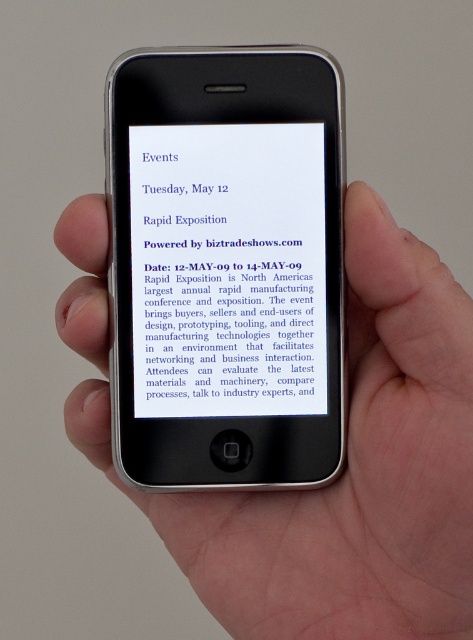
You are a person looking at the phone in the image. There are two points on the phone screen, one at coordinates point (273, 496) and another at point (194, 154). Which point is closer to the bottom edge of the phone screen?

Point (194, 154) is closer to the bottom edge of the phone screen because it is in front of point (273, 496), which is behind it.

You are trying to place both the black plastic phone at center and the blue paper at center into a rectangular box. Which object will require a wider box?

The black plastic phone at center requires a wider box since its width is larger than the blue paper at center.

You are taking a photo of the phone with your camera. Which of the two points, point (289, 404) or point (312, 323), will appear larger in the photo?

Point (289, 404) will appear larger in the photo because it is closer to the camera than point (312, 323).